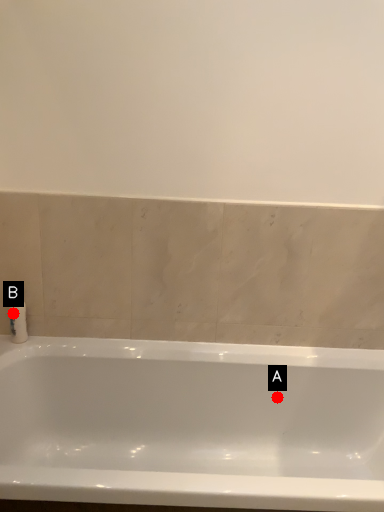
Question: Two points are circled on the image, labeled by A and B beside each circle. Which point is farther to the camera?

Choices:
 (A) A is further
 (B) B is further

Answer: (A)